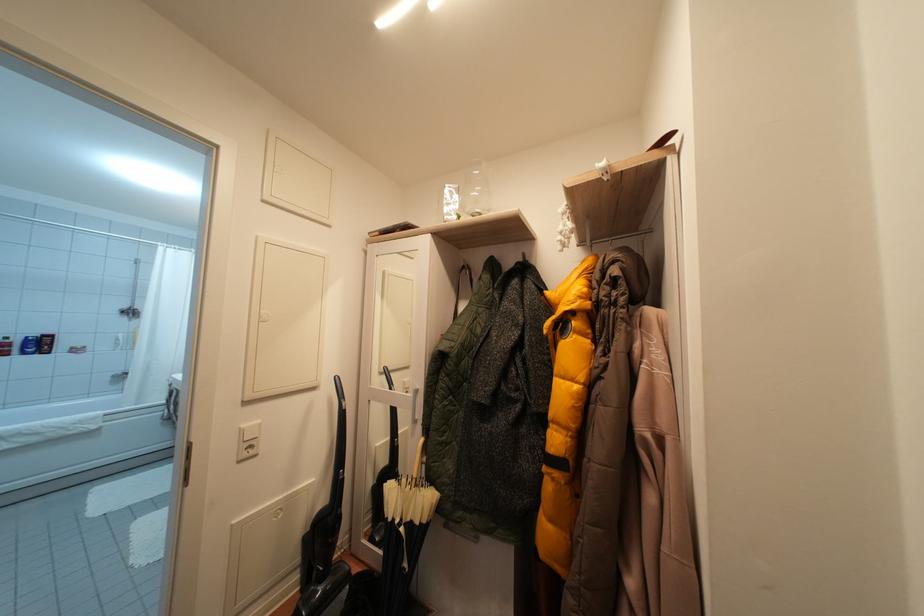
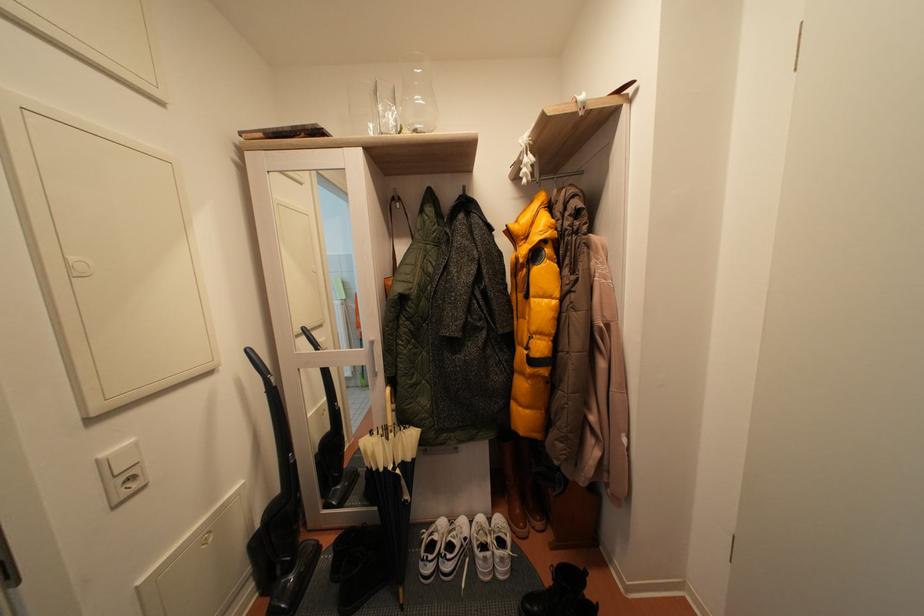
Question: I am providing you with two images of the same scene from different viewpoints. Which of the following objects are not visible in image2?

Choices:
 (A) clear drinking glass
 (B) white plastic clip
 (C) silver wall hook
 (D) none of these

Answer: (D)